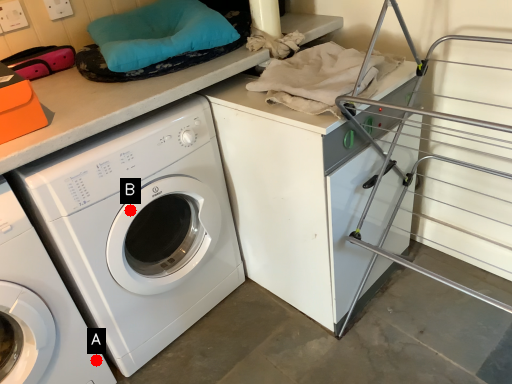
Question: Two points are circled on the image, labeled by A and B beside each circle. Which point appears closest to the camera in this image?

Choices:
 (A) A is closer
 (B) B is closer

Answer: (B)